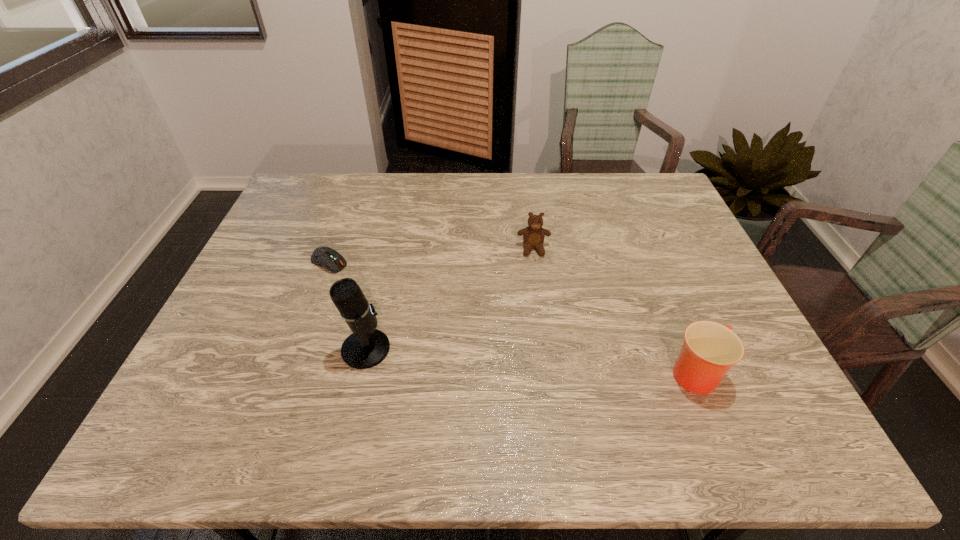
Where is `vacant region between the teddy bear and the computer equipment`? This screenshot has height=540, width=960. vacant region between the teddy bear and the computer equipment is located at coordinates (431, 255).

Identify the location of free space that is in between the tallest object and the teddy bear. The image size is (960, 540). (449, 299).

The image size is (960, 540). In order to click on free space between the tallest object and the rightmost object in this screenshot , I will do `click(532, 362)`.

You are a GUI agent. You are given a task and a screenshot of the screen. Output one action in this format:
    pyautogui.click(x=<x>, y=<y>)
    Task: Click on the vacant space that's between the teddy bear and the second object from left to right
    Image resolution: width=960 pixels, height=540 pixels.
    Given the screenshot: What is the action you would take?
    pyautogui.click(x=449, y=299)

Locate which object is the second closest to the computer equipment. Please provide its 2D coordinates. Your answer should be formatted as a tuple, i.e. [(x, y)], where the tuple contains the x and y coordinates of a point satisfying the conditions above.

[(533, 236)]

Select which object appears as the closest to the teddy bear. Please provide its 2D coordinates. Your answer should be formatted as a tuple, i.e. [(x, y)], where the tuple contains the x and y coordinates of a point satisfying the conditions above.

[(710, 349)]

This screenshot has height=540, width=960. Identify the location of free location that satisfies the following two spatial constraints: 1. on the front side of the cup; 2. on the right side of the second object from left to right. (360, 374).

Where is `vacant space that satisfies the following two spatial constraints: 1. on the front side of the third object from left to right; 2. on the left side of the cup`? The height and width of the screenshot is (540, 960). vacant space that satisfies the following two spatial constraints: 1. on the front side of the third object from left to right; 2. on the left side of the cup is located at coordinates (550, 374).